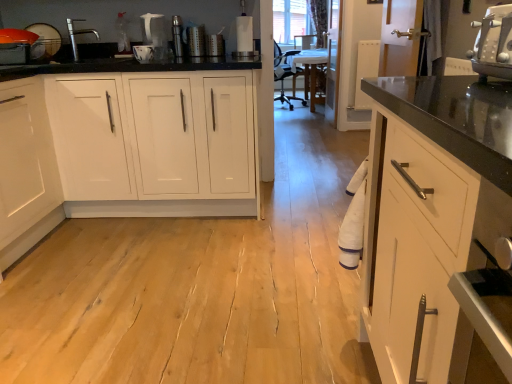
Question: Is the position of white plastic toaster at upper right more distant than that of metallic silver grater at upper center, which is the third appliance from left to right?

Choices:
 (A) no
 (B) yes

Answer: (A)

Question: Does white plastic toaster at upper right touch metallic silver grater at upper center, which is the third appliance from left to right?

Choices:
 (A) yes
 (B) no

Answer: (B)

Question: Is white plastic toaster at upper right far away from metallic silver grater at upper center, which is the 1th appliance from right to left?

Choices:
 (A) yes
 (B) no

Answer: (A)

Question: Is white plastic toaster at upper right positioned with its back to metallic silver grater at upper center, which is the 1th appliance from right to left?

Choices:
 (A) yes
 (B) no

Answer: (B)

Question: Is white plastic toaster at upper right at the right side of metallic silver grater at upper center, which is the third appliance from left to right?

Choices:
 (A) no
 (B) yes

Answer: (B)

Question: Do you think white glossy cabinet at left is within metallic cylindrical at center, the second appliance positioned from the left, or outside of it?

Choices:
 (A) outside
 (B) inside

Answer: (A)

Question: From the image's perspective, is white glossy cabinet at left above or below metallic cylindrical at center, arranged as the second appliance when viewed from the right?

Choices:
 (A) above
 (B) below

Answer: (B)

Question: Looking at the image, does white glossy cabinet at left seem bigger or smaller compared to metallic cylindrical at center, the second appliance positioned from the left?

Choices:
 (A) small
 (B) big

Answer: (B)

Question: In the image, is white glossy cabinet at left positioned in front of or behind metallic cylindrical at center, arranged as the second appliance when viewed from the right?

Choices:
 (A) behind
 (B) front

Answer: (B)

Question: From the image's perspective, relative to satin nickel faucet at upper left, is metallic silver grater at upper center, which is the 1th appliance from right to left, above or below?

Choices:
 (A) below
 (B) above

Answer: (B)

Question: Considering the positions of metallic silver grater at upper center, which is the 1th appliance from right to left, and satin nickel faucet at upper left in the image, is metallic silver grater at upper center, which is the 1th appliance from right to left, bigger or smaller than satin nickel faucet at upper left?

Choices:
 (A) big
 (B) small

Answer: (B)

Question: Based on their positions, is metallic silver grater at upper center, which is the 1th appliance from right to left, located to the left or right of satin nickel faucet at upper left?

Choices:
 (A) right
 (B) left

Answer: (A)

Question: From a real-world perspective, is metallic silver grater at upper center, which is the third appliance from left to right, positioned above or below satin nickel faucet at upper left?

Choices:
 (A) below
 (B) above

Answer: (A)

Question: Do you think metallic silver grater at upper center, which is the third appliance from left to right, is within white plastic toaster at upper right, or outside of it?

Choices:
 (A) outside
 (B) inside

Answer: (A)

Question: From a real-world perspective, is metallic silver grater at upper center, which is the 1th appliance from right to left, above or below white plastic toaster at upper right?

Choices:
 (A) below
 (B) above

Answer: (A)